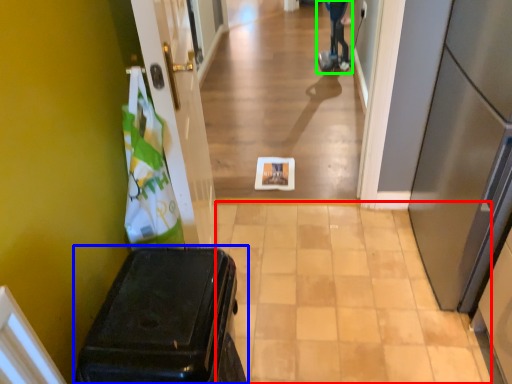
Question: Which is nearer to the path (highlighted by a red box)? suitcase (highlighted by a blue box) or mobility scooter (highlighted by a green box).

Choices:
 (A) suitcase
 (B) mobility scooter

Answer: (A)